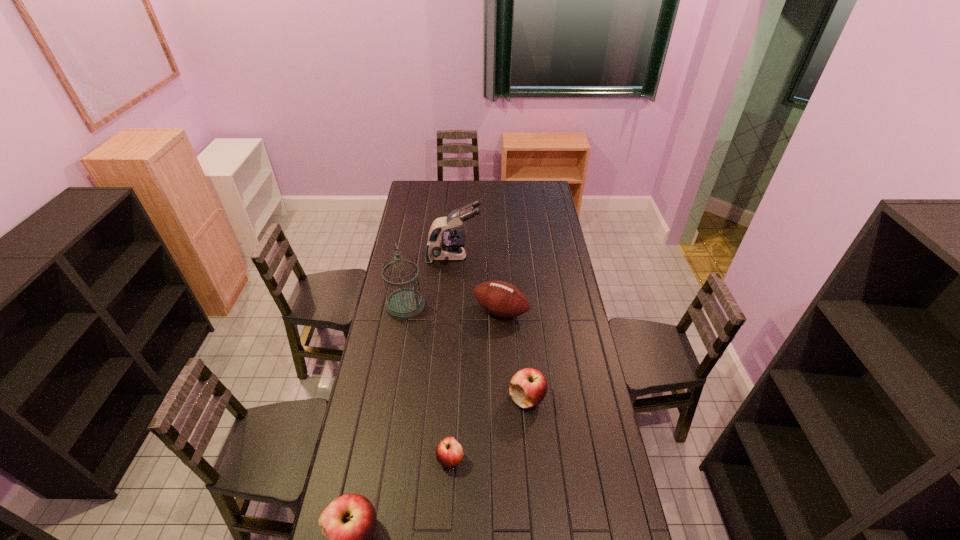
The width and height of the screenshot is (960, 540). In order to click on the shortest apple in this screenshot , I will do `click(449, 452)`.

What are the coordinates of `the second nearest object` in the screenshot? It's located at (449, 452).

Identify the location of the second shortest apple. The image size is (960, 540). (528, 387).

This screenshot has width=960, height=540. Identify the location of the rightmost apple. (528, 387).

You are a GUI agent. You are given a task and a screenshot of the screen. Output one action in this format:
    pyautogui.click(x=<x>, y=<y>)
    Task: Click on the birdcage
    This screenshot has width=960, height=540.
    Given the screenshot: What is the action you would take?
    pyautogui.click(x=405, y=303)

You are a GUI agent. You are given a task and a screenshot of the screen. Output one action in this format:
    pyautogui.click(x=<x>, y=<y>)
    Task: Click on the microscope
    The width and height of the screenshot is (960, 540).
    Given the screenshot: What is the action you would take?
    pyautogui.click(x=449, y=246)

I want to click on football (American), so tap(499, 298).

Identify the location of vacant space located on the back of the fifth farthest object. The width and height of the screenshot is (960, 540). (454, 382).

Where is `free spot located on the left of the farthest apple`? free spot located on the left of the farthest apple is located at coordinates (491, 399).

Identify the location of vacant space located on the front-facing side of the birdcage. This screenshot has height=540, width=960. (510, 305).